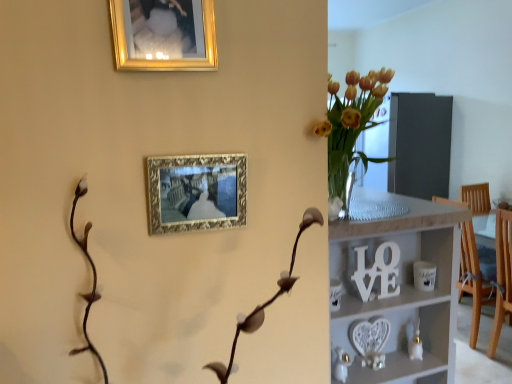
Question: Which direction should I rotate to look at gold metallic picture frame at upper center, which is the second picture frame from bottom to top?

Choices:
 (A) right
 (B) left

Answer: (B)

Question: Is gold ornate picture frame at upper center, which ranks as the 1th picture frame in bottom-to-top order, positioned behind white wooden shelf at center?

Choices:
 (A) no
 (B) yes

Answer: (A)

Question: From the image's perspective, does gold ornate picture frame at upper center, which ranks as the 1th picture frame in bottom-to-top order, appear lower than white wooden shelf at center?

Choices:
 (A) yes
 (B) no

Answer: (B)

Question: Is gold ornate picture frame at upper center, the second picture frame viewed from the top, next to white wooden shelf at center?

Choices:
 (A) no
 (B) yes

Answer: (A)

Question: Considering the relative sizes of gold ornate picture frame at upper center, which ranks as the 1th picture frame in bottom-to-top order, and white wooden shelf at center in the image provided, is gold ornate picture frame at upper center, which ranks as the 1th picture frame in bottom-to-top order, bigger than white wooden shelf at center?

Choices:
 (A) no
 (B) yes

Answer: (A)

Question: Could you tell me if gold ornate picture frame at upper center, which ranks as the 1th picture frame in bottom-to-top order, is facing white wooden shelf at center?

Choices:
 (A) yes
 (B) no

Answer: (B)

Question: Is gold ornate picture frame at upper center, the second picture frame viewed from the top, wider than white wooden shelf at center?

Choices:
 (A) yes
 (B) no

Answer: (B)

Question: Considering the relative positions of gold metallic picture frame at upper center, which is the second picture frame from bottom to top, and gold ornate picture frame at upper center, which ranks as the 1th picture frame in bottom-to-top order, in the image provided, is gold metallic picture frame at upper center, which is the second picture frame from bottom to top, to the right of gold ornate picture frame at upper center, which ranks as the 1th picture frame in bottom-to-top order, from the viewer's perspective?

Choices:
 (A) no
 (B) yes

Answer: (A)

Question: Is the position of gold metallic picture frame at upper center, the first picture frame in the top-to-bottom sequence, more distant than that of gold ornate picture frame at upper center, which ranks as the 1th picture frame in bottom-to-top order?

Choices:
 (A) yes
 (B) no

Answer: (B)

Question: From a real-world perspective, is gold metallic picture frame at upper center, which is the second picture frame from bottom to top, on top of gold ornate picture frame at upper center, the second picture frame viewed from the top?

Choices:
 (A) no
 (B) yes

Answer: (B)

Question: Does gold metallic picture frame at upper center, which is the second picture frame from bottom to top, turn towards gold ornate picture frame at upper center, which ranks as the 1th picture frame in bottom-to-top order?

Choices:
 (A) yes
 (B) no

Answer: (B)

Question: Does gold metallic picture frame at upper center, which is the second picture frame from bottom to top, have a greater width compared to gold ornate picture frame at upper center, which ranks as the 1th picture frame in bottom-to-top order?

Choices:
 (A) yes
 (B) no

Answer: (B)

Question: Is gold metallic picture frame at upper center, which is the second picture frame from bottom to top, facing away from gold ornate picture frame at upper center, which ranks as the 1th picture frame in bottom-to-top order?

Choices:
 (A) yes
 (B) no

Answer: (B)

Question: Does white wooden shelf at center lie behind gold ornate picture frame at upper center, the second picture frame viewed from the top?

Choices:
 (A) no
 (B) yes

Answer: (B)